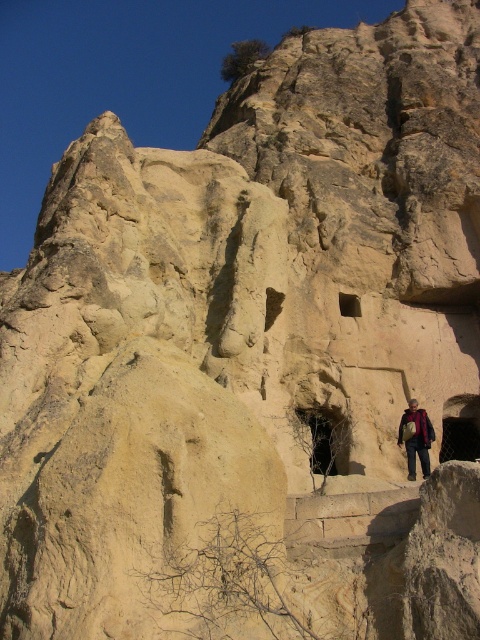
Is dark brown leather jacket at lower center bigger than brown textured jacket at lower right?

Yes.

Is dark brown leather jacket at lower center behind brown textured jacket at lower right?

No, dark brown leather jacket at lower center is in front of brown textured jacket at lower right.

Image resolution: width=480 pixels, height=640 pixels. What do you see at coordinates (417, 438) in the screenshot?
I see `dark brown leather jacket at lower center` at bounding box center [417, 438].

Find the location of a particular element. Image resolution: width=480 pixels, height=640 pixels. dark brown leather jacket at lower center is located at coordinates (417, 438).